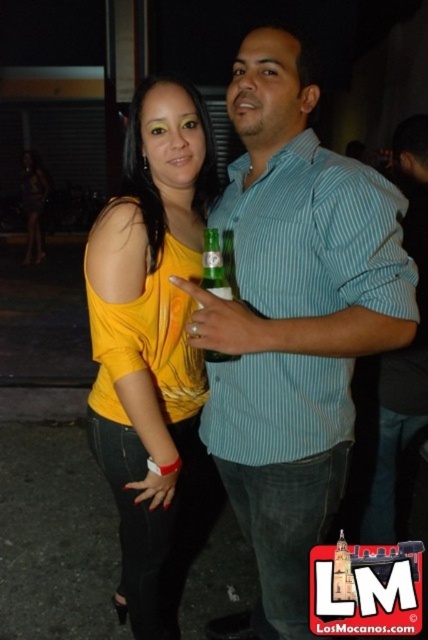
Question: Is matte yellow tank top at center closer to the viewer compared to yellow matte tank top at center?

Choices:
 (A) yes
 (B) no

Answer: (A)

Question: Which object is positioned farthest from the matte blue shirt at center?

Choices:
 (A) matte yellow tank top at center
 (B) green glass bottle at center

Answer: (A)

Question: Can you confirm if matte yellow tank top at center is positioned to the left of yellow matte tank top at center?

Choices:
 (A) no
 (B) yes

Answer: (A)

Question: Which object appears farthest from the camera in this image?

Choices:
 (A) matte blue shirt at center
 (B) yellow matte tank top at center
 (C) green glass bottle at center
 (D) matte yellow tank top at center

Answer: (B)

Question: Where is matte yellow tank top at center located in relation to green glass bottle at center in the image?

Choices:
 (A) right
 (B) left

Answer: (B)

Question: Which of the following is the farthest from the observer?

Choices:
 (A) (26, 244)
 (B) (199, 355)

Answer: (A)